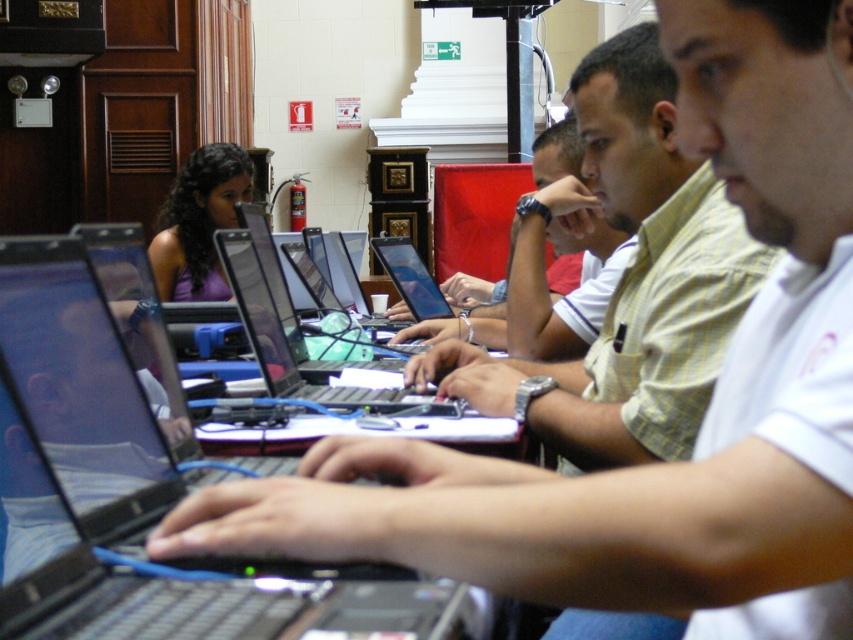
Is black glossy laptop at center to the left of purple matte tank top at center from the viewer's perspective?

No, black glossy laptop at center is not to the left of purple matte tank top at center.

Does black glossy laptop at center have a greater height compared to purple matte tank top at center?

No, black glossy laptop at center is not taller than purple matte tank top at center.

Is point (428, 624) farther from viewer compared to point (231, 150)?

No, (428, 624) is in front of (231, 150).

Find the location of a particular element. The height and width of the screenshot is (640, 853). black glossy laptop at center is located at coordinates (80, 394).

Which of these two, purple matte tank top at center or shiny black laptop at center, stands shorter?

shiny black laptop at center is shorter.

Consider the image. Does purple matte tank top at center have a lesser width compared to shiny black laptop at center?

In fact, purple matte tank top at center might be wider than shiny black laptop at center.

Is point (204, 273) closer to viewer compared to point (347, 307)?

Yes, it is in front of point (347, 307).

Image resolution: width=853 pixels, height=640 pixels. I want to click on purple matte tank top at center, so click(199, 221).

Between light yellow shirt at center and shiny black laptop at center, which one appears on the right side from the viewer's perspective?

light yellow shirt at center is more to the right.

The image size is (853, 640). Describe the element at coordinates (630, 284) in the screenshot. I see `light yellow shirt at center` at that location.

This screenshot has width=853, height=640. I want to click on light yellow shirt at center, so click(x=630, y=284).